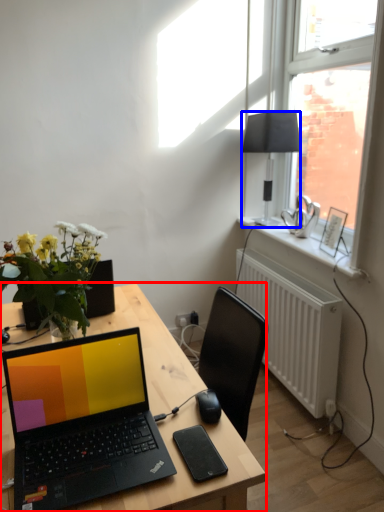
Question: Which object is further to the camera taking this photo, desk (highlighted by a red box) or lamp (highlighted by a blue box)?

Choices:
 (A) desk
 (B) lamp

Answer: (B)